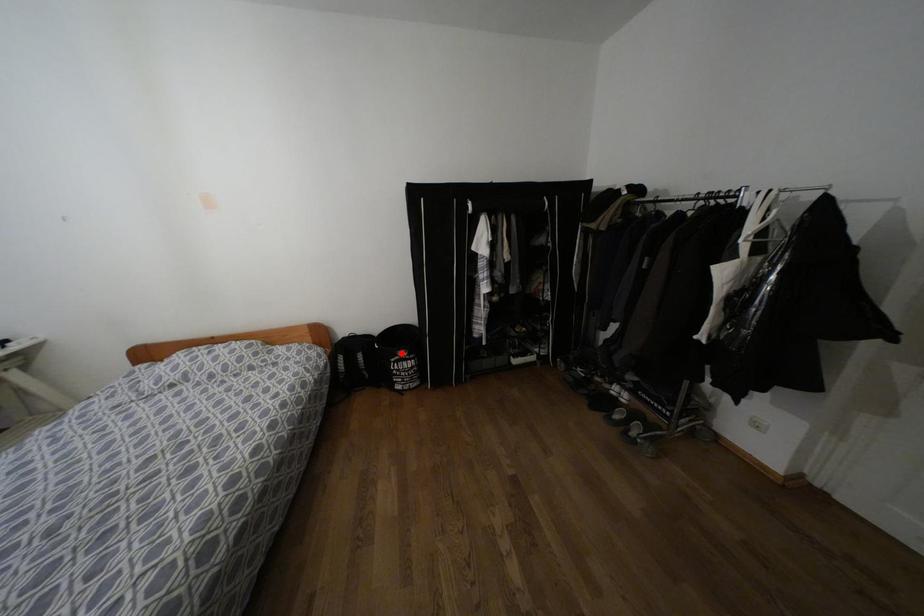
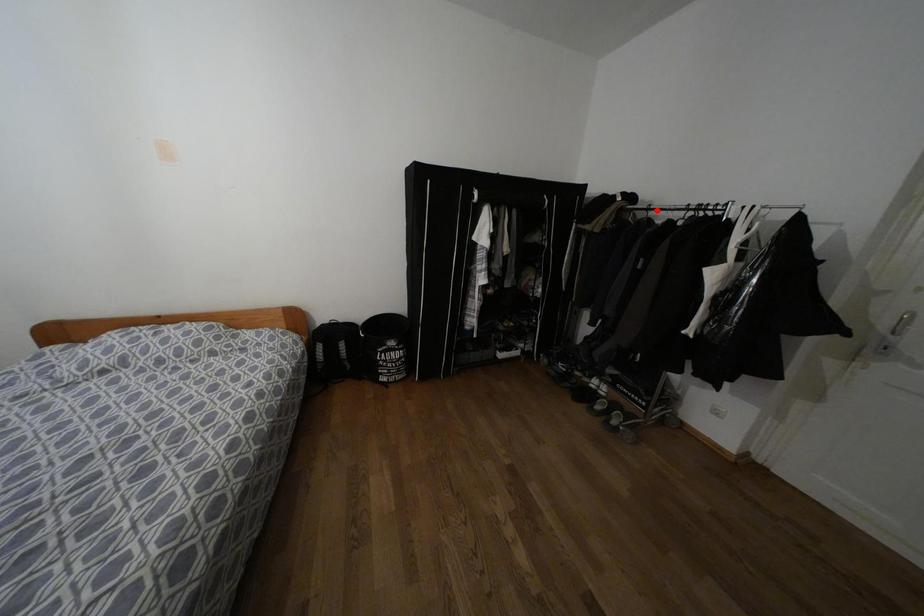
I am providing you with two images of the same scene from different viewpoints. A red point is marked on the first image and another point is marked on the second image. Is the red point in image1 aligned with the point shown in image2?

No